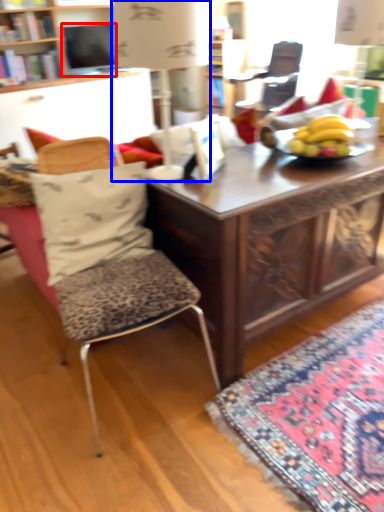
Question: Which of the following is the closest to the observer, television (highlighted by a red box) or table lamp (highlighted by a blue box)?

Choices:
 (A) television
 (B) table lamp

Answer: (B)